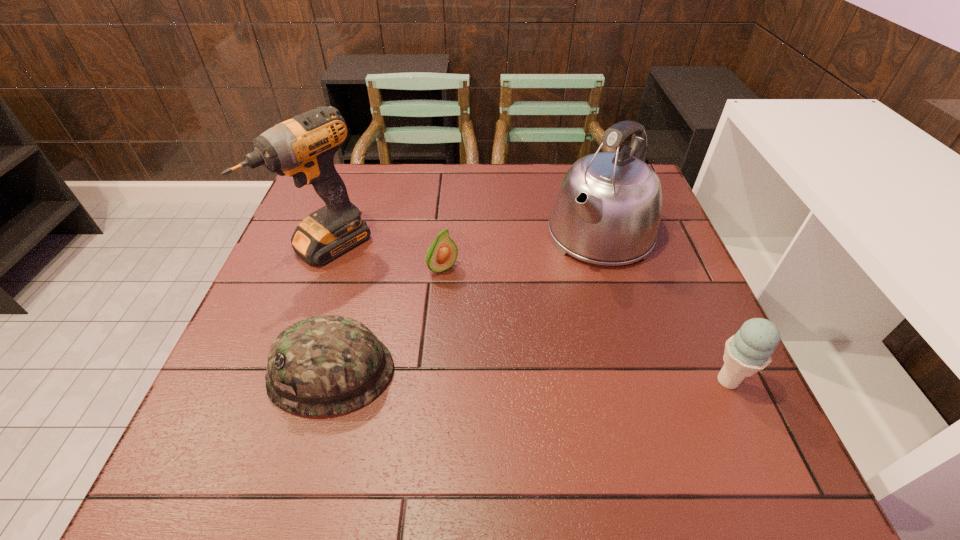
The height and width of the screenshot is (540, 960). Find the location of `headwear`. headwear is located at coordinates (326, 365).

Where is `the third tallest object`? the third tallest object is located at coordinates (748, 351).

The height and width of the screenshot is (540, 960). Identify the location of kettle. (607, 210).

Find the location of `avocado`. avocado is located at coordinates (442, 254).

Where is `drill`? The image size is (960, 540). drill is located at coordinates (303, 147).

This screenshot has width=960, height=540. I want to click on free space located 0.290m on the back of the headwear, so click(x=368, y=242).

Locate an element on the screen. This screenshot has width=960, height=540. free location located on the left of the third shortest object is located at coordinates (520, 381).

Find the location of a particular element. vacant space located 0.120m on the spout of the kettle is located at coordinates (552, 296).

This screenshot has width=960, height=540. In order to click on vacant space located on the spout of the kettle in this screenshot , I will do `click(508, 349)`.

Find the location of a particular element. free location located on the spout of the kettle is located at coordinates (545, 304).